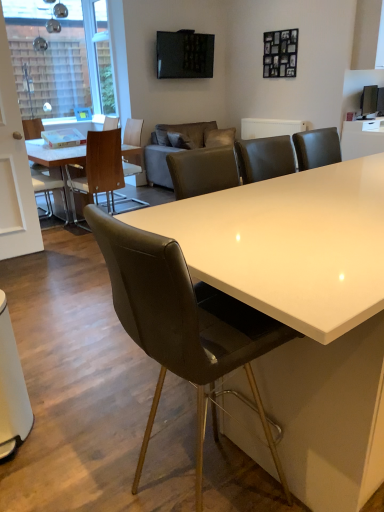
Identify the location of vacant space to the left of leather at center, placed as the fourth chair when sorted from back to front. The image size is (384, 512). (96, 465).